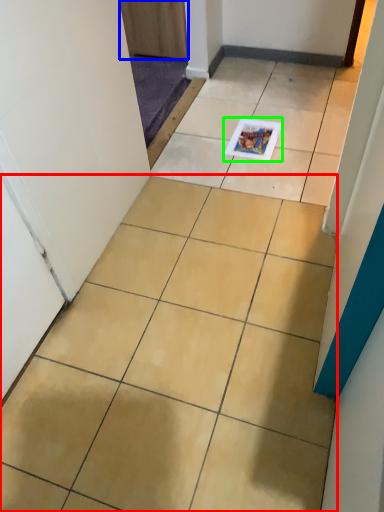
Question: Based on their relative distances, which object is farther from ceramic tile (highlighted by a red box)? Choose from door (highlighted by a blue box) and magazine (highlighted by a green box).

Choices:
 (A) door
 (B) magazine

Answer: (A)